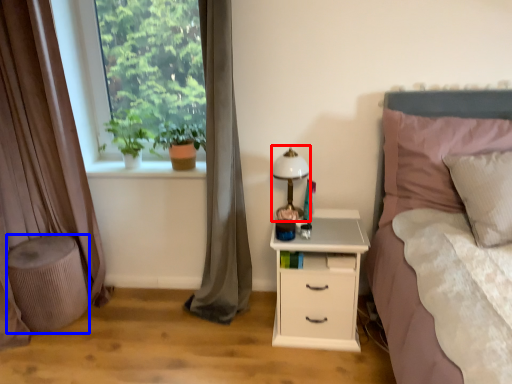
Question: Which object is further to the camera taking this photo, bedside lamp (highlighted by a red box) or stool (highlighted by a blue box)?

Choices:
 (A) bedside lamp
 (B) stool

Answer: (B)